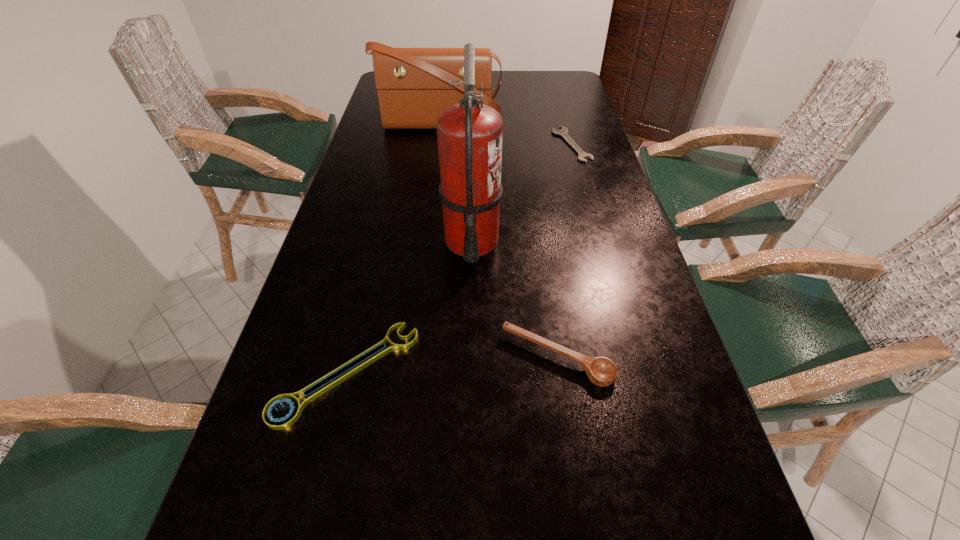
Locate an element on the screen. The height and width of the screenshot is (540, 960). the third nearest object is located at coordinates (469, 134).

The image size is (960, 540). In order to click on fire extinguisher in this screenshot , I will do `click(469, 134)`.

Where is `satchel`? The image size is (960, 540). satchel is located at coordinates (412, 84).

You are a GUI agent. You are given a task and a screenshot of the screen. Output one action in this format:
    pyautogui.click(x=<x>, y=<y>)
    Task: Click on the third shortest object
    This screenshot has width=960, height=540.
    Given the screenshot: What is the action you would take?
    pyautogui.click(x=601, y=371)

Where is `the left wrench`? Image resolution: width=960 pixels, height=540 pixels. the left wrench is located at coordinates (279, 424).

Find the location of a particular element. the farther wrench is located at coordinates (563, 132).

You are a GUI agent. You are given a task and a screenshot of the screen. Output one action in this format:
    pyautogui.click(x=<x>, y=<y>)
    Task: Click on the free space located 0.130m toward the nozzle of the third nearest object
    Image resolution: width=960 pixels, height=540 pixels.
    Given the screenshot: What is the action you would take?
    pyautogui.click(x=555, y=241)

I want to click on free location located on the front flap of the satchel, so click(430, 198).

The width and height of the screenshot is (960, 540). Identify the location of free space located on the left of the wooden spoon. (413, 357).

The image size is (960, 540). In order to click on blank space located 0.070m on the right of the left wrench in this screenshot , I will do `click(452, 373)`.